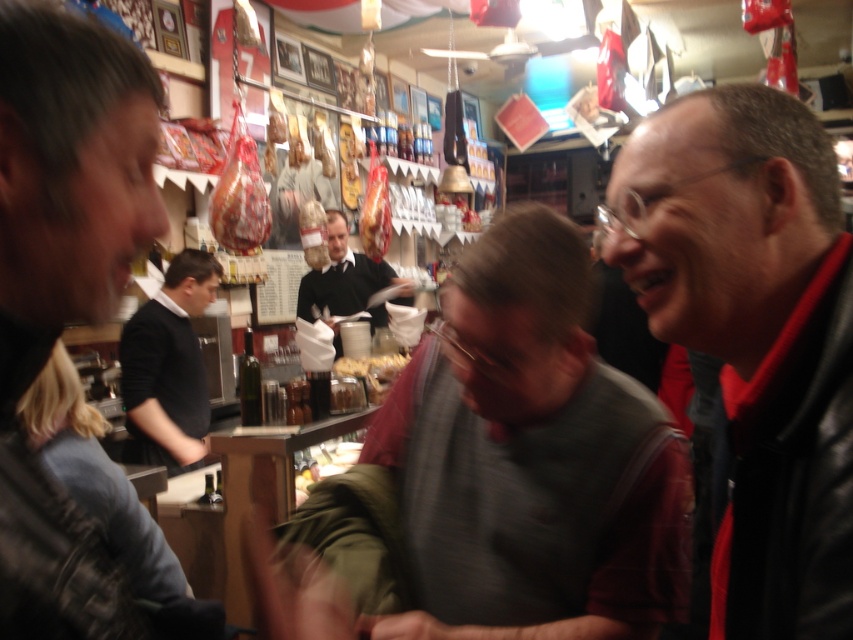
Question: Estimate the real-world distances between objects in this image. Which object is farther from the gray zippered jacket at center?

Choices:
 (A) black leather jacket at center
 (B) dark red leather jacket at right
 (C) black shirt at left

Answer: (A)

Question: Which object is positioned closest to the black shirt at left?

Choices:
 (A) gray zippered jacket at center
 (B) dark red leather jacket at right
 (C) dark blue denim jacket at lower left

Answer: (C)

Question: Does gray zippered jacket at center appear on the right side of dark blue denim jacket at lower left?

Choices:
 (A) yes
 (B) no

Answer: (A)

Question: Which point is farther to the camera?

Choices:
 (A) (80, 392)
 (B) (476, 435)
 (C) (161, 448)
 (D) (12, 150)

Answer: (C)

Question: Does gray zippered jacket at center lie behind dark blue denim jacket at lower left?

Choices:
 (A) no
 (B) yes

Answer: (A)

Question: Does dark gray shirt at center lie behind black shirt at left?

Choices:
 (A) no
 (B) yes

Answer: (A)